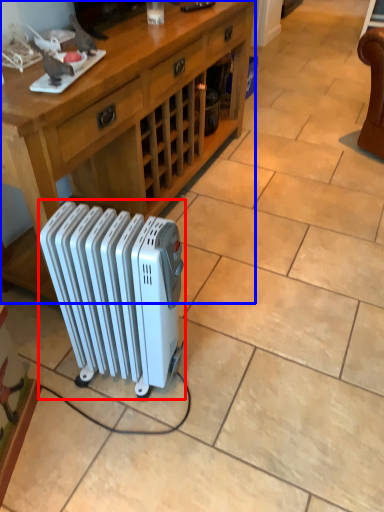
Question: Which point is further to the camera, radiator (highlighted by a red box) or desk (highlighted by a blue box)?

Choices:
 (A) radiator
 (B) desk

Answer: (B)